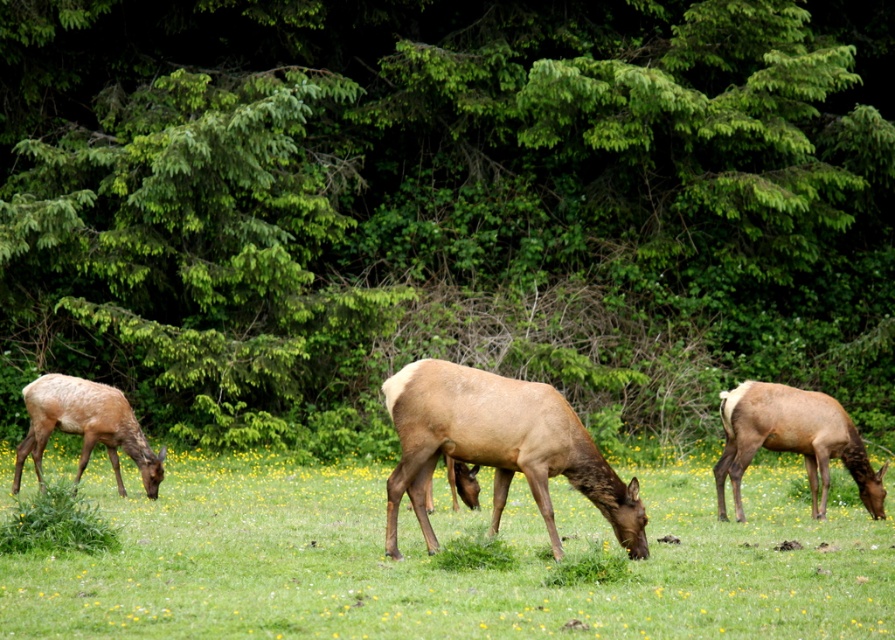
Describe the element at coordinates (442, 568) in the screenshot. I see `green grass at center` at that location.

Between green grass at center and brown velvet deer at left, which one is positioned lower?

green grass at center

At what (x,y) coordinates should I click in order to perform the action: click on green grass at center. Please return your answer as a coordinate pair (x, y). The height and width of the screenshot is (640, 895). Looking at the image, I should click on (442, 568).

Can you confirm if green leafy tree at center is taller than brown matte/deer at center?

Indeed, green leafy tree at center has a greater height compared to brown matte/deer at center.

The width and height of the screenshot is (895, 640). Find the location of `green leafy tree at center`. green leafy tree at center is located at coordinates (445, 208).

Between green leafy tree at center and green grass at center, which one is positioned higher?

Positioned higher is green leafy tree at center.

Which is in front, point (634, 186) or point (806, 518)?

Point (806, 518) is more forward.

Who is more forward, [590,403] or [371,560]?

Point [371,560] is in front.

I want to click on green leafy tree at center, so click(x=445, y=208).